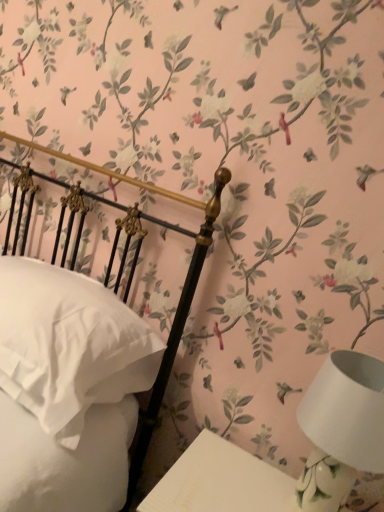
What is the approximate height of white soft pillow at left?

white soft pillow at left is 12.26 inches tall.

At what (x,y) coordinates should I click in order to perform the action: click on white glossy table at lower right. Please return your answer as a coordinate pair (x, y). Looking at the image, I should click on (220, 481).

In order to face white ceramic table lamp at lower right, should I rotate leftwards or rightwards?

A 19.029 degree turn to the right will do.

This screenshot has width=384, height=512. Find the location of `white soft pillow at left`. white soft pillow at left is located at coordinates (69, 345).

Is white ceramic table lamp at lower right surrounding white soft pillow at left?

No, white soft pillow at left is not surrounded by white ceramic table lamp at lower right.

Considering the relative sizes of white ceramic table lamp at lower right and white soft pillow at left in the image provided, is white ceramic table lamp at lower right bigger than white soft pillow at left?

No, white ceramic table lamp at lower right is not bigger than white soft pillow at left.

Is white ceramic table lamp at lower right further to the viewer compared to white soft pillow at left?

No, it is not.

From the image's perspective, between white ceramic table lamp at lower right and white soft pillow at left, which one is located above?

white soft pillow at left.

From a real-world perspective, relative to white ceramic table lamp at lower right, is white soft pillow at left vertically above or below?

From a real-world perspective, white soft pillow at left is physically below white ceramic table lamp at lower right.

Is white soft pillow at left positioned behind white ceramic table lamp at lower right?

Yes.

Is point (143, 388) positioned before point (380, 371)?

No, (143, 388) is behind (380, 371).

Considering the positions of objects white soft pillow at left and white ceramic table lamp at lower right in the image provided, who is more to the right, white soft pillow at left or white ceramic table lamp at lower right?

From the viewer's perspective, white ceramic table lamp at lower right appears more on the right side.

From the image's perspective, between white soft pillow at left and white glossy table at lower right, who is located below?

white glossy table at lower right is shown below in the image.

Relative to white glossy table at lower right, is white soft pillow at left in front or behind?

Clearly, white soft pillow at left is behind white glossy table at lower right.

How different are the orientations of white soft pillow at left and white glossy table at lower right in degrees?

4.76 degrees separate the facing orientations of white soft pillow at left and white glossy table at lower right.

Would you say white soft pillow at left is outside white glossy table at lower right?

Yes, white soft pillow at left is not within white glossy table at lower right.

The height and width of the screenshot is (512, 384). Find the location of `table that appears below the white soft pillow at left (from the image's perspective)`. table that appears below the white soft pillow at left (from the image's perspective) is located at coordinates (220, 481).

Is point (167, 496) more distant than point (90, 396)?

That is False.

Is white glossy table at lower right oriented away from white soft pillow at left?

No.

Is white glossy table at lower right not inside white soft pillow at left?

Yes, white glossy table at lower right is not within white soft pillow at left.

Based on their sizes in the image, would you say white glossy table at lower right is bigger or smaller than white ceramic table lamp at lower right?

Clearly, white glossy table at lower right is larger in size than white ceramic table lamp at lower right.

From the image's perspective, is white glossy table at lower right on white ceramic table lamp at lower right?

Incorrect, from the image's perspective, white glossy table at lower right is lower than white ceramic table lamp at lower right.

Is point (272, 493) closer or farther from the camera than point (313, 475)?

Point (272, 493) is farther from the camera than point (313, 475).

Is white glossy table at lower right wider or thinner than white ceramic table lamp at lower right?

Clearly, white glossy table at lower right has more width compared to white ceramic table lamp at lower right.

From a real-world perspective, which object rests below the other?

white glossy table at lower right.

Which point is more distant from viewer, (315, 475) or (265, 507)?

The point (265, 507) is more distant.

Is white ceramic table lamp at lower right at the right side of white glossy table at lower right?

Yes.

From the image's perspective, which one is positioned lower, white ceramic table lamp at lower right or white glossy table at lower right?

From the image's view, white glossy table at lower right is below.

Find the location of a particular element. The image size is (384, 512). table lamp lying in front of the white soft pillow at left is located at coordinates (341, 428).

Image resolution: width=384 pixels, height=512 pixels. Find the location of `table lamp above the white soft pillow at left (from a real-world perspective)`. table lamp above the white soft pillow at left (from a real-world perspective) is located at coordinates (341, 428).

Estimate the real-world distances between objects in this image. Which object is further from white soft pillow at left, white glossy table at lower right or white ceramic table lamp at lower right?

white ceramic table lamp at lower right is further to white soft pillow at left.

Which object lies nearer to the anchor point white soft pillow at left, white ceramic table lamp at lower right or white glossy table at lower right?

The object closer to white soft pillow at left is white glossy table at lower right.

Which object lies further to the anchor point white glossy table at lower right, white ceramic table lamp at lower right or white soft pillow at left?

white soft pillow at left is positioned further to the anchor white glossy table at lower right.

Estimate the real-world distances between objects in this image. Which object is closer to white ceramic table lamp at lower right, white soft pillow at left or white glossy table at lower right?

white glossy table at lower right is positioned closer to the anchor white ceramic table lamp at lower right.

When comparing their distances from white ceramic table lamp at lower right, does white glossy table at lower right or white soft pillow at left seem closer?

white glossy table at lower right is closer to white ceramic table lamp at lower right.

Looking at the image, which one is located closer to white glossy table at lower right, white soft pillow at left or white ceramic table lamp at lower right?

white ceramic table lamp at lower right.

Find the location of a particular element. table located between white soft pillow at left and white ceramic table lamp at lower right in the left-right direction is located at coordinates (220, 481).